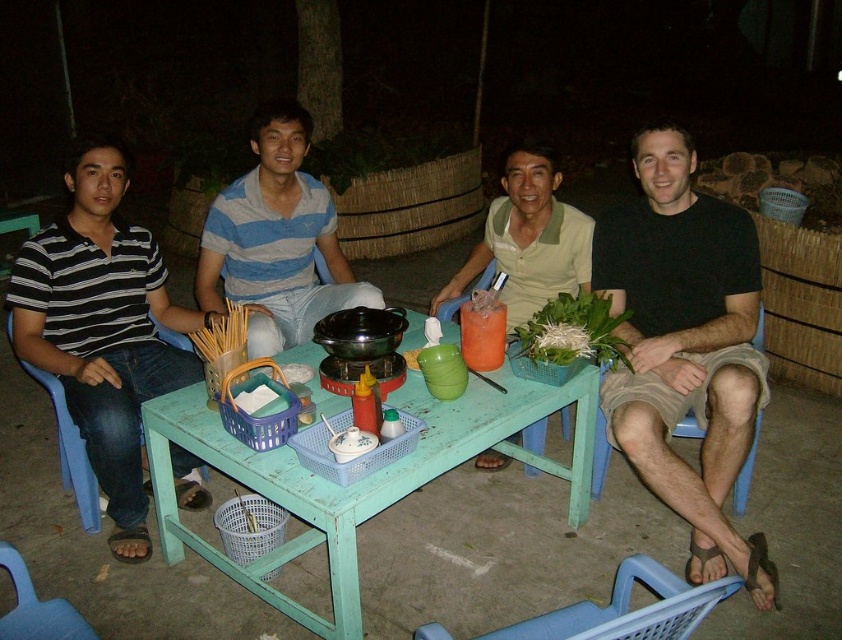
Does black striped shirt at left have a lesser width compared to green matte shirt at center?

Incorrect, black striped shirt at left's width is not less than green matte shirt at center's.

Does black striped shirt at left appear over green matte shirt at center?

Actually, black striped shirt at left is below green matte shirt at center.

What do you see at coordinates (102, 330) in the screenshot? The width and height of the screenshot is (842, 640). I see `black striped shirt at left` at bounding box center [102, 330].

Where is `black striped shirt at left`? This screenshot has width=842, height=640. black striped shirt at left is located at coordinates [x=102, y=330].

This screenshot has width=842, height=640. What do you see at coordinates (685, 348) in the screenshot? I see `black cotton shirt at right` at bounding box center [685, 348].

Is black cotton shirt at right positioned before green matte shirt at center?

Yes, black cotton shirt at right is closer to the viewer.

Does point (709, 244) come behind point (560, 209)?

No.

You are a GUI agent. You are given a task and a screenshot of the screen. Output one action in this format:
    pyautogui.click(x=<x>, y=<y>)
    Task: Click on the black cotton shirt at right
    
    Given the screenshot: What is the action you would take?
    pyautogui.click(x=685, y=348)

Is black striped shirt at left shorter than striped cotton shirt at center?

No.

Looking at this image, does black striped shirt at left have a smaller size compared to striped cotton shirt at center?

Indeed, black striped shirt at left has a smaller size compared to striped cotton shirt at center.

Who is more distant from viewer, (89,173) or (288,177)?

Positioned behind is point (288,177).

Locate an element on the screen. black striped shirt at left is located at coordinates (102, 330).